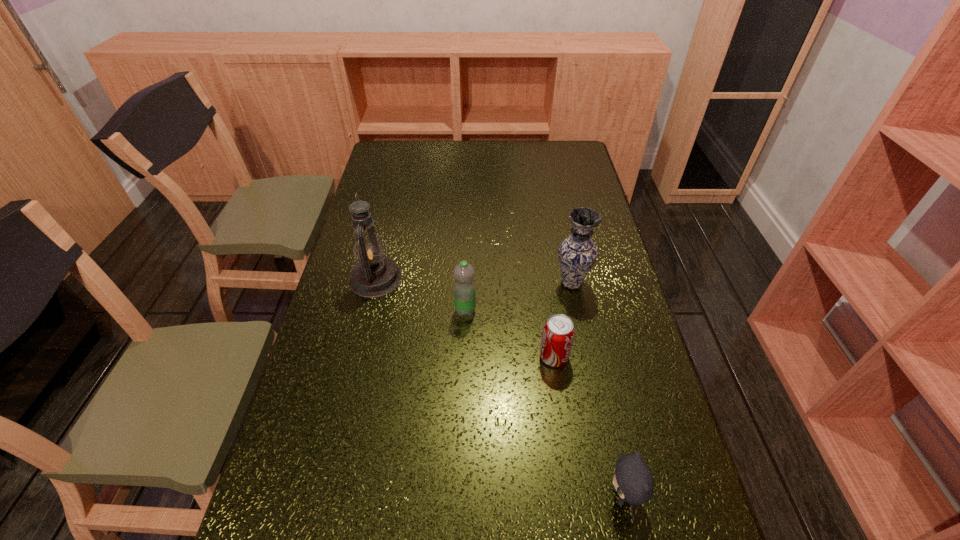
Locate an element on the screen. vacant space that's between the water bottle and the nearest object is located at coordinates (544, 403).

Where is `object that stands as the second closest to the oil lamp`? object that stands as the second closest to the oil lamp is located at coordinates (558, 333).

Locate which object ranks third in proximity to the fourth object from right to left. Please provide its 2D coordinates. Your answer should be formatted as a tuple, i.e. [(x, y)], where the tuple contains the x and y coordinates of a point satisfying the conditions above.

[(577, 254)]

In order to click on vacant space that satisfies the following two spatial constraints: 1. on the front side of the fourth shortest object; 2. on the right side of the oil lamp in this screenshot , I will do `click(374, 283)`.

Where is `free space that satisfies the following two spatial constraints: 1. on the front side of the oil lamp; 2. on the left side of the fourth object from right to left`? This screenshot has height=540, width=960. free space that satisfies the following two spatial constraints: 1. on the front side of the oil lamp; 2. on the left side of the fourth object from right to left is located at coordinates (368, 310).